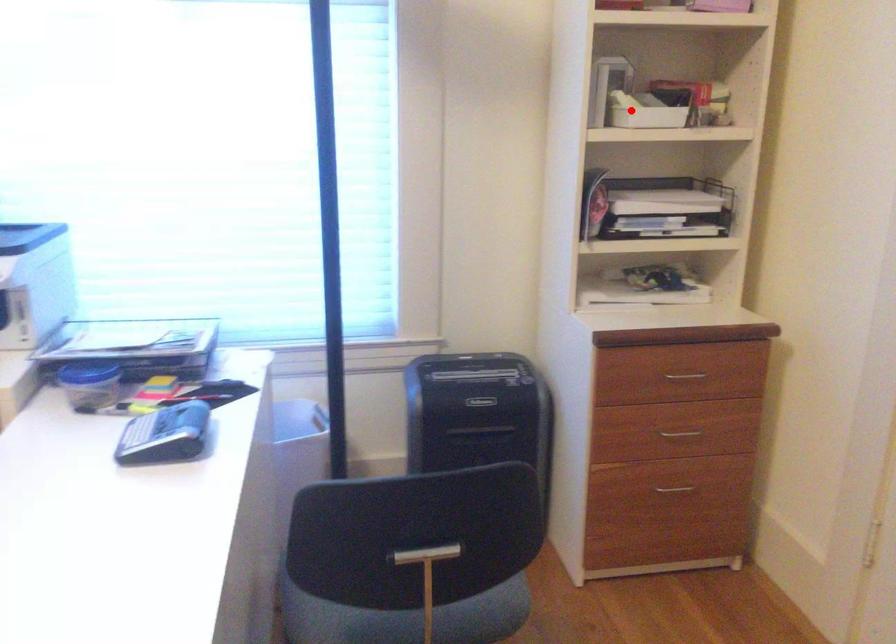
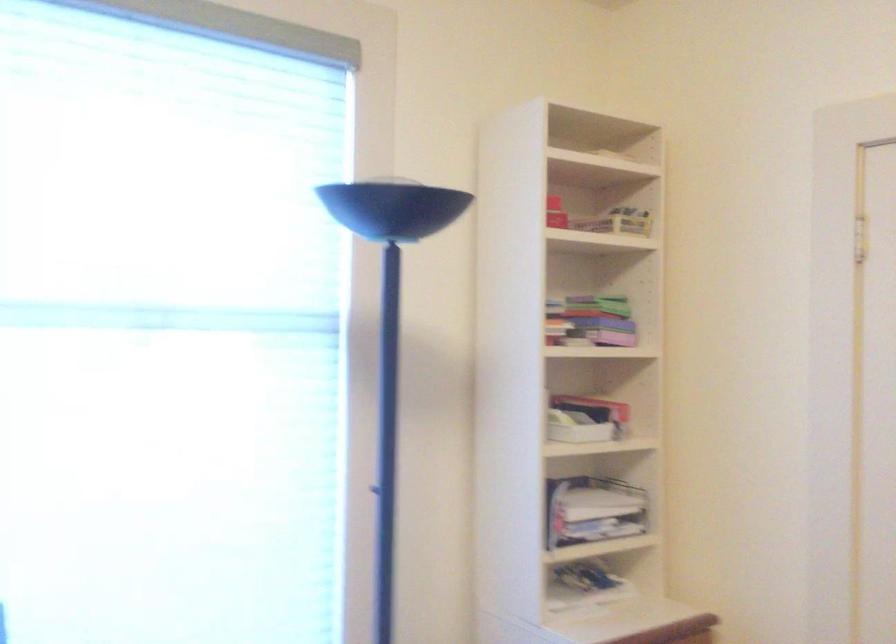
Question: I am providing you with two images of the same scene from different viewpoints. A red point is shown in image1. For the corresponding object point in image2, is it positioned nearer or farther from the camera?

Choices:
 (A) Nearer
 (B) Farther

Answer: (B)